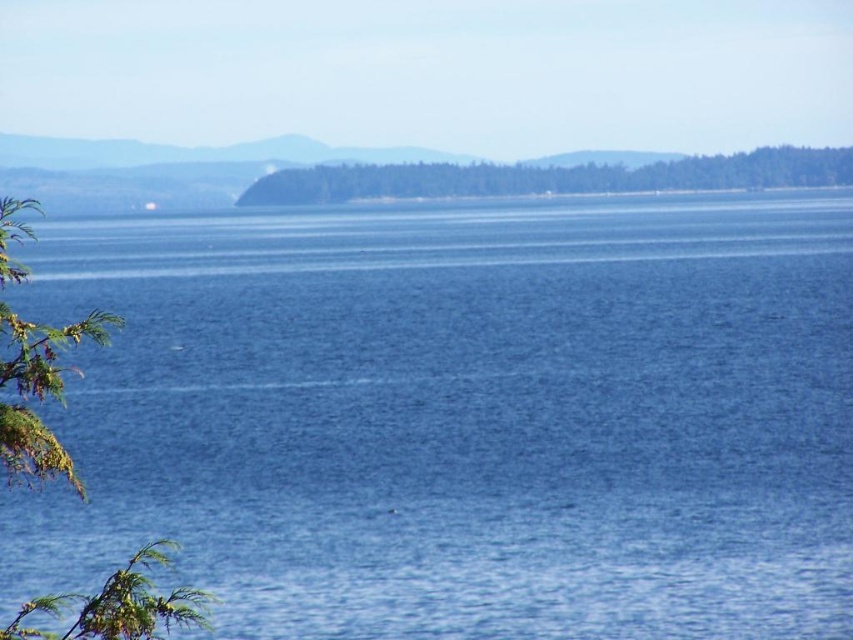
Does blue water at center have a lesser height compared to green leafy tree at center?

Incorrect, blue water at center's height does not fall short of green leafy tree at center's.

At what (x,y) coordinates should I click in order to perform the action: click on blue water at center. Please return your answer as a coordinate pair (x, y). The width and height of the screenshot is (853, 640). Looking at the image, I should click on (460, 417).

The width and height of the screenshot is (853, 640). I want to click on blue water at center, so click(460, 417).

Can you confirm if blue water at center is wider than green leafy branch at left?

Indeed, blue water at center has a greater width compared to green leafy branch at left.

Looking at this image, who is shorter, blue water at center or green leafy branch at left?

green leafy branch at left is shorter.

Which is in front, point (718, 596) or point (61, 461)?

Point (61, 461)

At what (x,y) coordinates should I click in order to perform the action: click on blue water at center. Please return your answer as a coordinate pair (x, y). Image resolution: width=853 pixels, height=640 pixels. Looking at the image, I should click on (460, 417).

Between point (57, 348) and point (735, 179), which one is positioned in front?

Point (57, 348) is in front.

Is green leafy branch at left bigger than green leafy tree at center?

No.

Between point (119, 608) and point (851, 179), which one is positioned behind?

The point (851, 179) is behind.

Find the location of a particular element. The image size is (853, 640). green leafy branch at left is located at coordinates (38, 392).